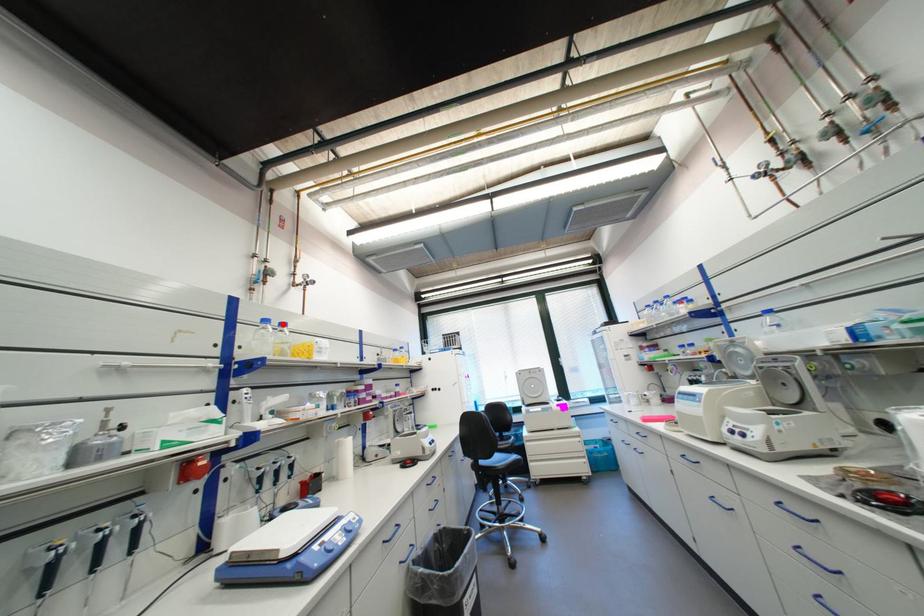
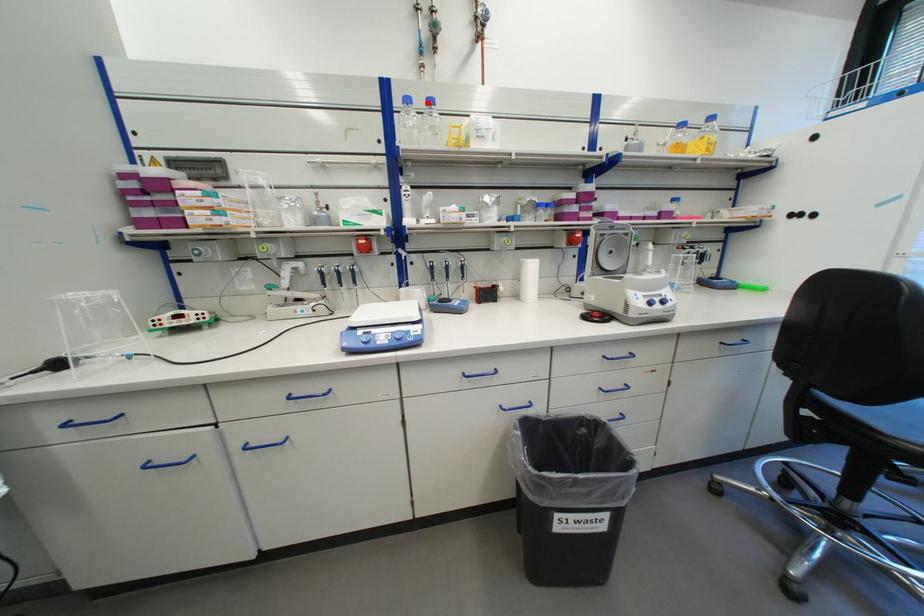
I am providing you with two images of the same scene from different viewpoints. A red point is marked on the first image and another point is marked on the second image. Are the points marked in image1 and image2 representing the same 3D position?

Yes